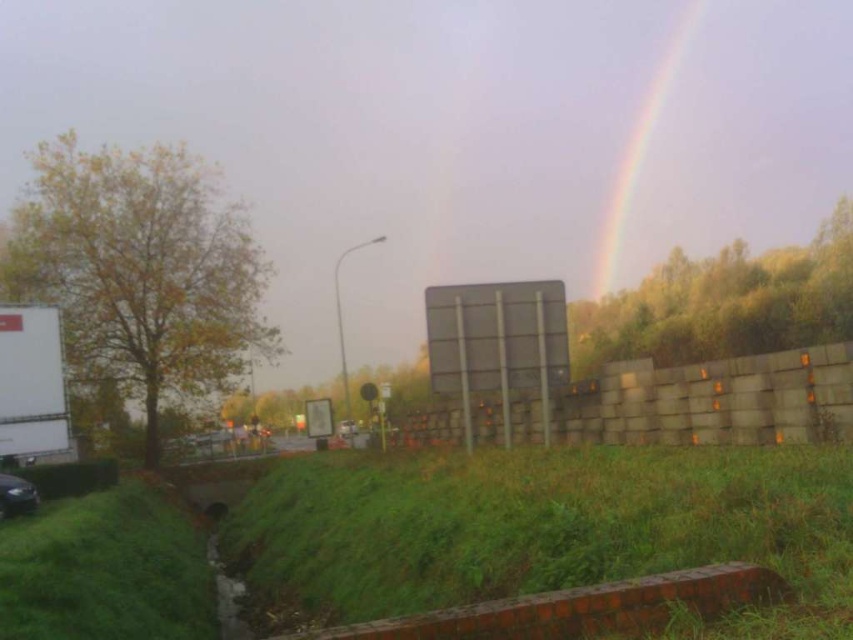
Question: Which point is farther to the camera?

Choices:
 (A) (57, 403)
 (B) (660, 88)
 (C) (154, 566)
 (D) (730, 536)

Answer: (B)

Question: Which point appears farthest from the camera in this image?

Choices:
 (A) (708, 628)
 (B) (639, 108)

Answer: (B)

Question: Is green grass at lower center to the right of shiny black car at lower left from the viewer's perspective?

Choices:
 (A) yes
 (B) no

Answer: (A)

Question: Can you confirm if green grass at lower left is thinner than rainbow at upper right?

Choices:
 (A) no
 (B) yes

Answer: (B)

Question: Is white matte trailer truck at left to the right of rainbow at upper right from the viewer's perspective?

Choices:
 (A) yes
 (B) no

Answer: (B)

Question: Among these points, which one is farthest from the camera?

Choices:
 (A) (477, 513)
 (B) (619, 232)
 (C) (30, 486)
 (D) (13, 627)

Answer: (B)